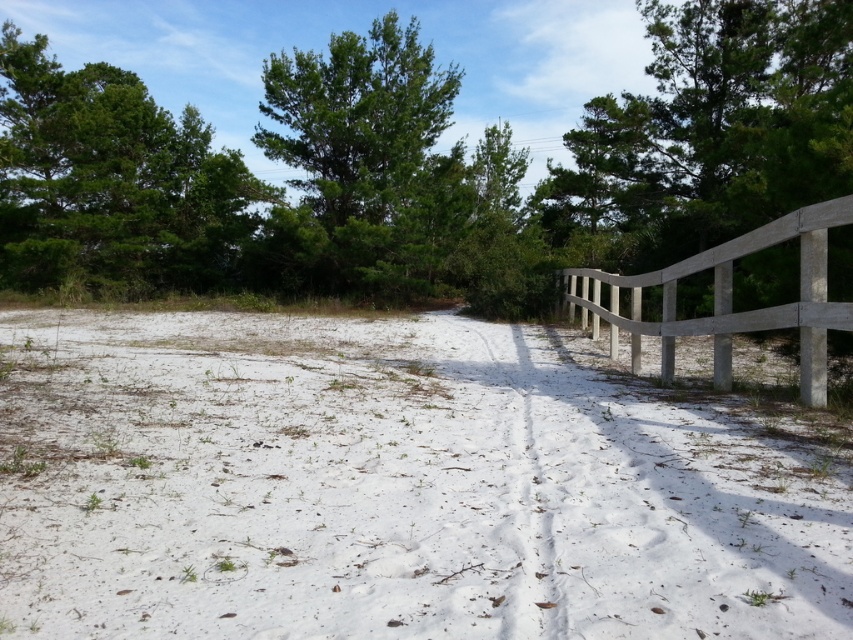
You are a GUI agent. You are given a task and a screenshot of the screen. Output one action in this format:
    pyautogui.click(x=<x>, y=<y>)
    Task: Click on the white sandy path at center
    The width and height of the screenshot is (853, 640).
    Given the screenshot: What is the action you would take?
    pyautogui.click(x=387, y=490)

Who is more distant from viewer, (605, 493) or (399, 276)?

The point (399, 276) is behind.

Locate an element on the screen. The height and width of the screenshot is (640, 853). white sandy path at center is located at coordinates (387, 490).

This screenshot has width=853, height=640. What are the coordinates of `white sandy path at center` in the screenshot? It's located at click(x=387, y=490).

Who is shorter, green leafy tree at center or gray wooden fence at right?

gray wooden fence at right is shorter.

Between green leafy tree at center and gray wooden fence at right, which one appears on the left side from the viewer's perspective?

green leafy tree at center

Is point (328, 195) closer to viewer compared to point (767, 314)?

No, it is not.

The width and height of the screenshot is (853, 640). In order to click on green leafy tree at center in this screenshot , I will do `click(370, 152)`.

Is green leafy tree at upper center to the right of green leafy tree at center from the viewer's perspective?

In fact, green leafy tree at upper center is to the left of green leafy tree at center.

Between green leafy tree at upper center and green leafy tree at center, which one has more height?

green leafy tree at upper center is taller.

This screenshot has height=640, width=853. Identify the location of green leafy tree at upper center. (419, 166).